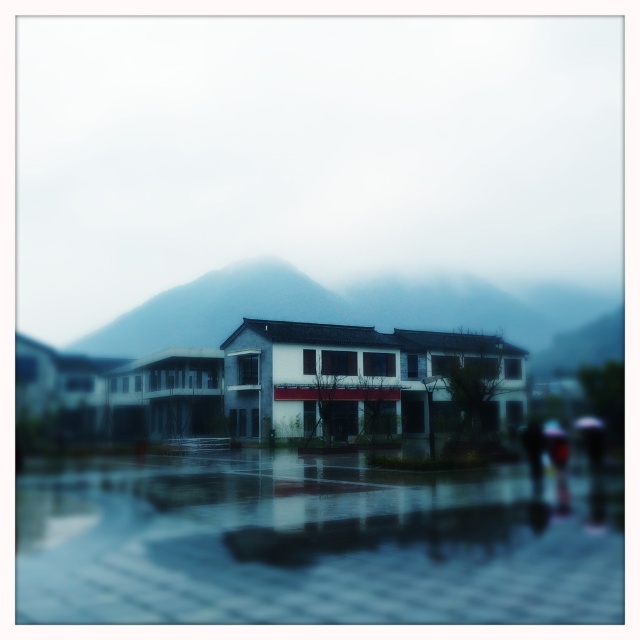
Who is higher up, glossy reflective water at lower center or matte gray mountain at center?

matte gray mountain at center is higher up.

In the scene shown: Which is below, glossy reflective water at lower center or matte gray mountain at center?

glossy reflective water at lower center is lower down.

I want to click on glossy reflective water at lower center, so click(310, 545).

The image size is (640, 640). I want to click on glossy reflective water at lower center, so click(310, 545).